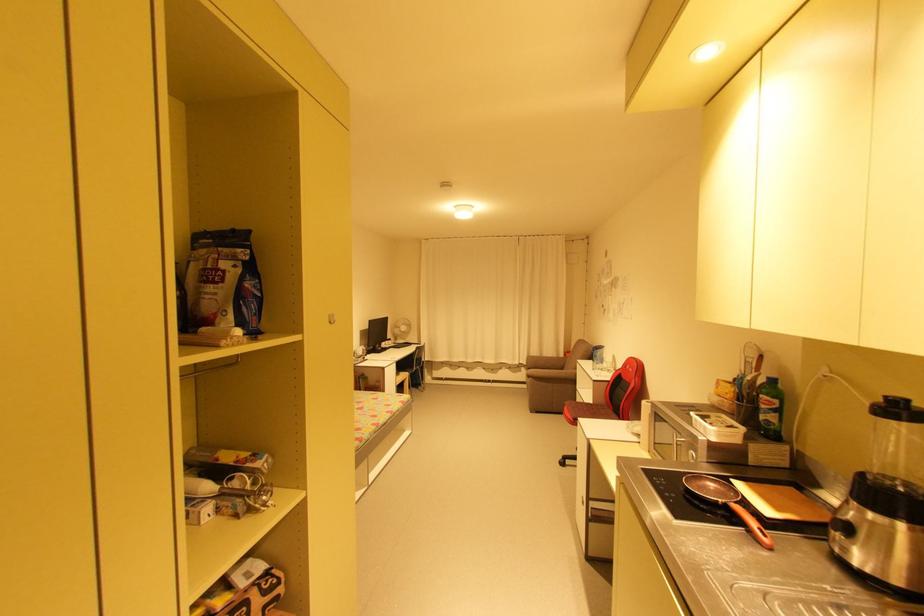
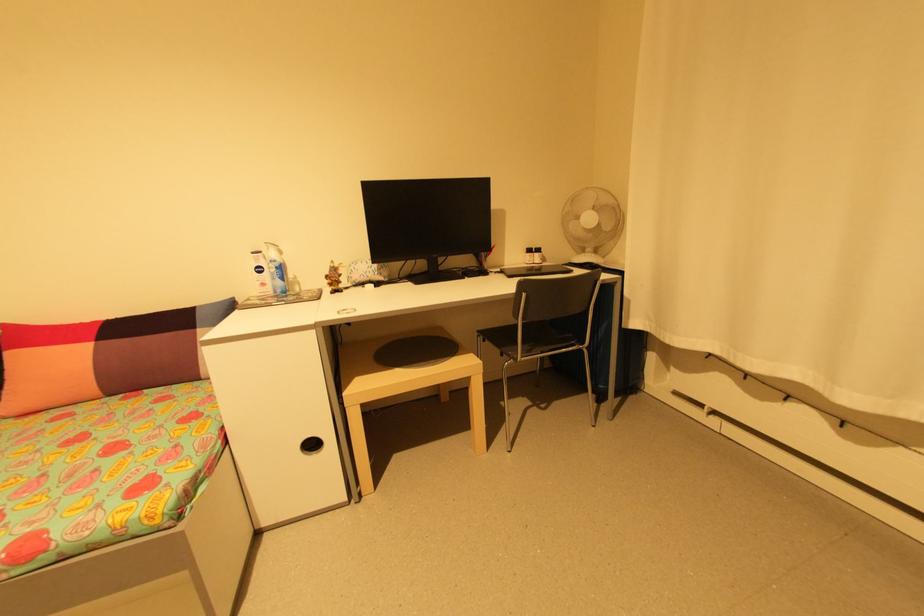
In the second image, find the point that corresponds to point (395, 342) in the first image.

(541, 254)